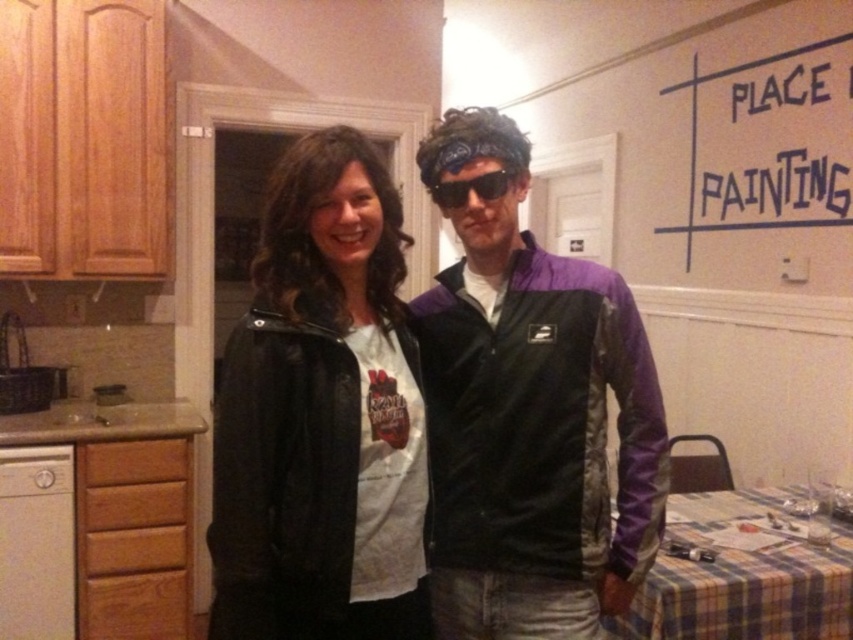
Which is in front, point (498, 371) or point (503, 173)?

Point (503, 173)

Who is more forward, [440,467] or [482,180]?

Positioned in front is point [482,180].

Where is `purple/black jacket at center`? purple/black jacket at center is located at coordinates (529, 413).

Is matte black jacket at center positioned at the back of sunglasses at center?

No.

Can you confirm if matte black jacket at center is taller than sunglasses at center?

Indeed, matte black jacket at center has a greater height compared to sunglasses at center.

Who is more forward, (364, 244) or (492, 179)?

Point (364, 244) is in front.

Locate an element on the screen. The image size is (853, 640). matte black jacket at center is located at coordinates (321, 416).

Measure the distance between purple/black jacket at center and matte black jacket at center.

A distance of 7.89 inches exists between purple/black jacket at center and matte black jacket at center.

Where is `purple/black jacket at center`? purple/black jacket at center is located at coordinates (529, 413).

Where is `purple/black jacket at center`? purple/black jacket at center is located at coordinates (529, 413).